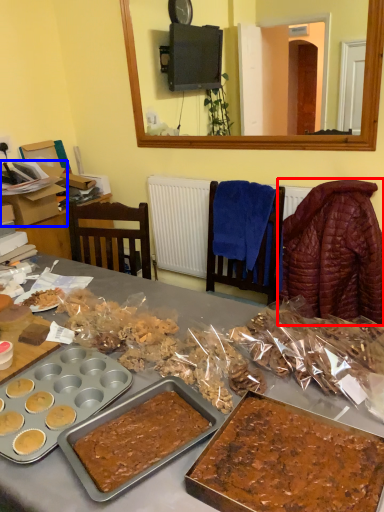
Question: Which object is closer to the camera taking this photo, blanket (highlighted by a red box) or box (highlighted by a blue box)?

Choices:
 (A) blanket
 (B) box

Answer: (A)